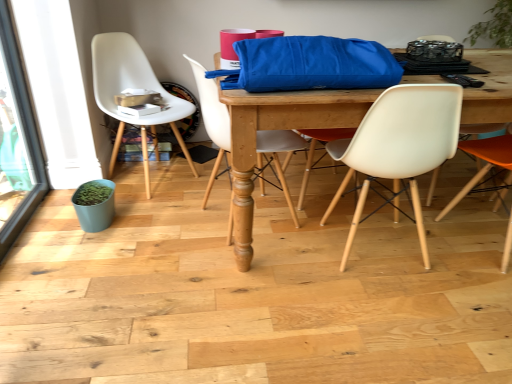
Where is `free space to the back side of black plastic remote control at upper right`? free space to the back side of black plastic remote control at upper right is located at coordinates (444, 75).